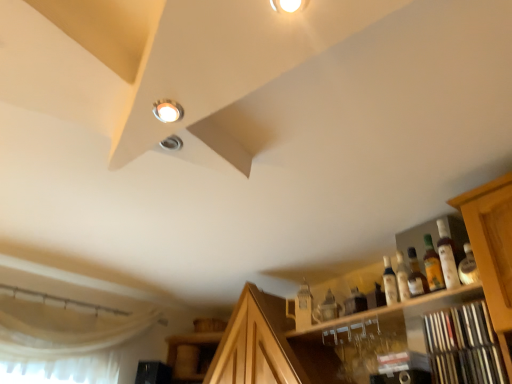
Question: Considering the relative sizes of wooden shelf at lower right and matte glass bottle at right, arranged as the 3th bottle when viewed from the right, in the image provided, is wooden shelf at lower right shorter than matte glass bottle at right, arranged as the 3th bottle when viewed from the right,?

Choices:
 (A) yes
 (B) no

Answer: (B)

Question: From the image's perspective, is wooden shelf at lower right located above matte glass bottle at right, arranged as the 3th bottle when viewed from the right?

Choices:
 (A) no
 (B) yes

Answer: (A)

Question: Can matte glass bottle at right, arranged as the 3th bottle when viewed from the right, be found inside wooden shelf at lower right?

Choices:
 (A) yes
 (B) no

Answer: (B)

Question: Can you confirm if wooden shelf at lower right is bigger than matte glass bottle at right, arranged as the 3th bottle when viewed from the right?

Choices:
 (A) no
 (B) yes

Answer: (B)

Question: Is wooden shelf at lower right taller than matte glass bottle at right, arranged as the 3th bottle when viewed from the right?

Choices:
 (A) no
 (B) yes

Answer: (B)

Question: Is wooden shelf at lower right turned away from matte glass bottle at right, the 1th bottle positioned from the left?

Choices:
 (A) yes
 (B) no

Answer: (B)

Question: From the image's perspective, is matte glass bottle at right, the 1th bottle positioned from the left, on matte white droplight at upper left?

Choices:
 (A) yes
 (B) no

Answer: (B)

Question: Considering the relative sizes of matte glass bottle at right, arranged as the 3th bottle when viewed from the right, and matte white droplight at upper left in the image provided, is matte glass bottle at right, arranged as the 3th bottle when viewed from the right, wider than matte white droplight at upper left?

Choices:
 (A) yes
 (B) no

Answer: (B)

Question: Does matte glass bottle at right, the 1th bottle positioned from the left, lie in front of matte white droplight at upper left?

Choices:
 (A) no
 (B) yes

Answer: (A)

Question: Considering the relative sizes of matte glass bottle at right, arranged as the 3th bottle when viewed from the right, and matte white droplight at upper left in the image provided, is matte glass bottle at right, arranged as the 3th bottle when viewed from the right, taller than matte white droplight at upper left?

Choices:
 (A) no
 (B) yes

Answer: (B)

Question: From the image's perspective, is matte glass bottle at right, arranged as the 3th bottle when viewed from the right, beneath matte white droplight at upper left?

Choices:
 (A) no
 (B) yes

Answer: (B)

Question: Considering the relative positions of matte glass bottle at right, arranged as the 3th bottle when viewed from the right, and matte white droplight at upper left in the image provided, is matte glass bottle at right, arranged as the 3th bottle when viewed from the right, behind matte white droplight at upper left?

Choices:
 (A) yes
 (B) no

Answer: (A)

Question: Does matte white droplight at upper left appear on the right side of wooden shelf at lower right?

Choices:
 (A) no
 (B) yes

Answer: (A)